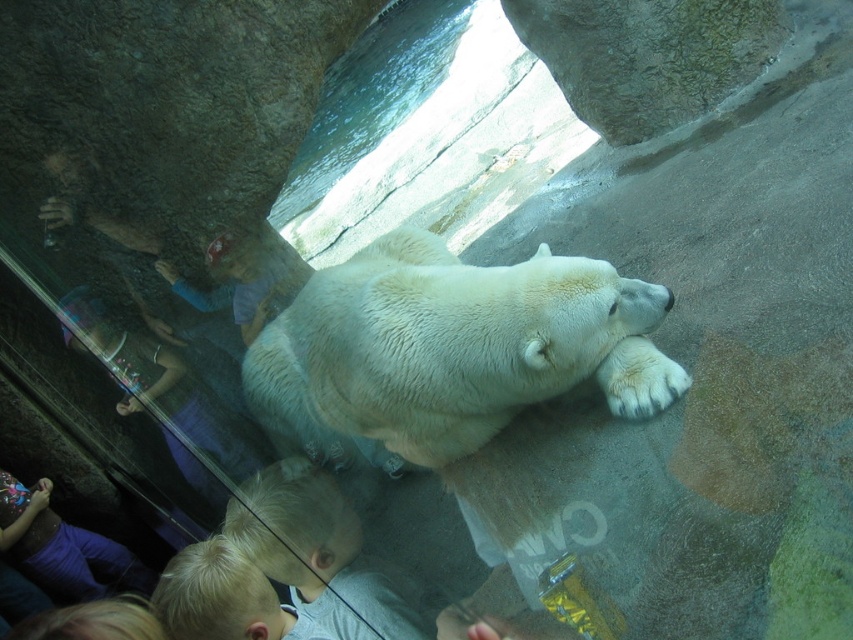
You are a zookeeper planning to place a new feeding station in the polar bear exhibit. The station must be placed at least 2 meters away from the white fluffy polar bear at center to ensure safety. Given the coordinates of the bear, can you determine if a proposed station at point A located at coordinates 0.6, 0.6 is within the safe distance?

The white fluffy polar bear at center is located at coordinates (450, 349). The proposed feeding station at point A is at (511, 384). To determine the distance between these points, calculate the Euclidean distance. The difference in x is 0.052 and in y is 0.072. Squaring these gives 0.0027 and 0.0052, summing to 0.0079. The square root of this is approximately 0.089, which is 0.089 meters. Since 0.089 meters is less than 2 meters, the proposed station is too close. Place it further away.